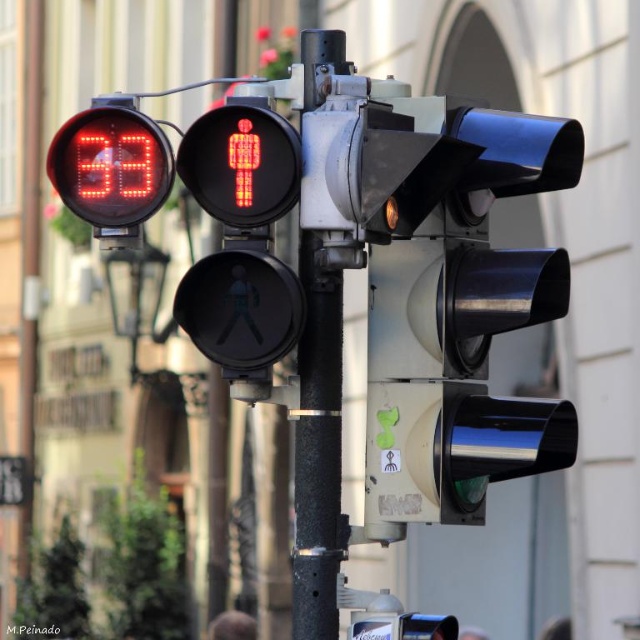
You are standing in front of the traffic light and want to touch both points on the pole. Which point, point (301, 212) or point (97, 173), is closer to you?

Point (301, 212) is closer to you than point (97, 173).

You are a pedestrian waiting at the crosswalk. You see the black metal pole at center and the red led display at upper left. Which object is closer to the left side of the crosswalk?

The red led display at upper left is closer to the left side of the crosswalk because the black metal pole at center is positioned on the right side of it.